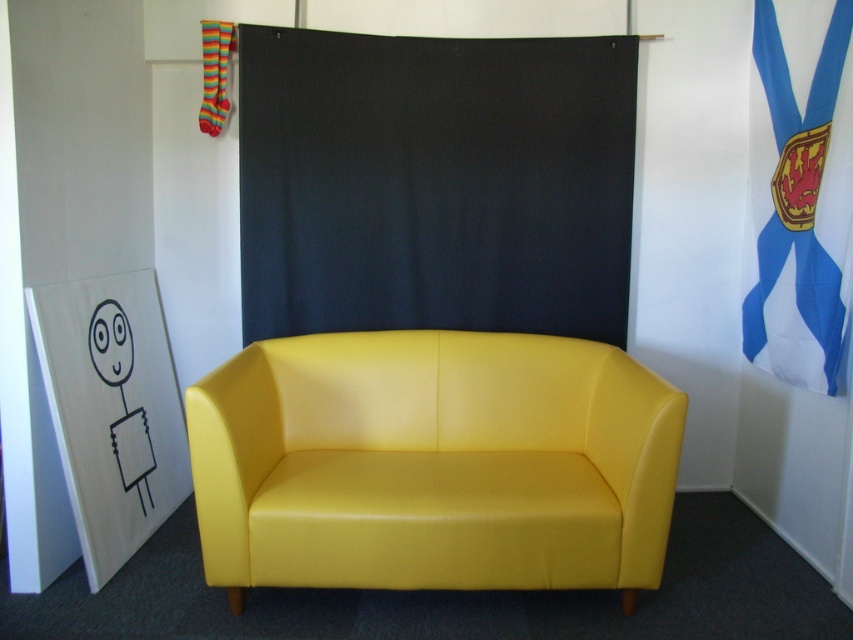
Question: Which object is the farthest from the black fabric curtain at center?

Choices:
 (A) yellow leather armchair at center
 (B) blue fabric flag at upper right

Answer: (B)

Question: Estimate the real-world distances between objects in this image. Which object is closer to the blue fabric flag at upper right?

Choices:
 (A) black fabric curtain at center
 (B) yellow leather armchair at center

Answer: (A)

Question: Estimate the real-world distances between objects in this image. Which object is farther from the black fabric curtain at center?

Choices:
 (A) yellow leather armchair at center
 (B) blue fabric flag at upper right

Answer: (B)

Question: Where is yellow leather armchair at center located in relation to blue fabric flag at upper right in the image?

Choices:
 (A) below
 (B) above

Answer: (A)

Question: Does yellow leather armchair at center appear under black fabric curtain at center?

Choices:
 (A) no
 (B) yes

Answer: (B)

Question: Is yellow leather armchair at center behind black fabric curtain at center?

Choices:
 (A) yes
 (B) no

Answer: (B)